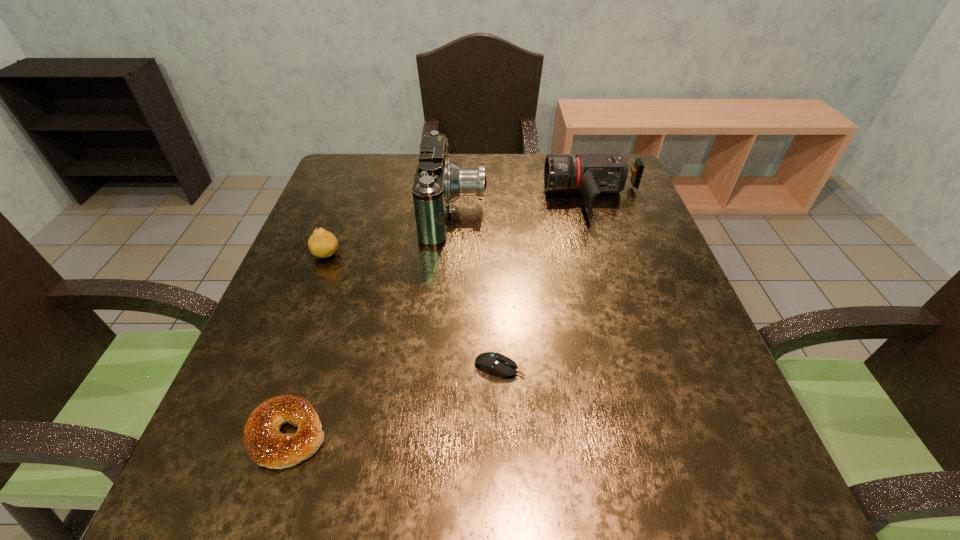
Locate an element on the screen. blank area in the image that satisfies the following two spatial constraints: 1. on the front-facing side of the tallest object; 2. on the front side of the fourth tallest object is located at coordinates (439, 434).

You are a GUI agent. You are given a task and a screenshot of the screen. Output one action in this format:
    pyautogui.click(x=<x>, y=<y>)
    Task: Click on the free spot that satisfies the following two spatial constraints: 1. on the front side of the computer mouse; 2. on the right side of the pear
    This screenshot has height=540, width=960.
    Given the screenshot: What is the action you would take?
    pyautogui.click(x=283, y=367)

You are a GUI agent. You are given a task and a screenshot of the screen. Output one action in this format:
    pyautogui.click(x=<x>, y=<y>)
    Task: Click on the vacant region that satisfies the following two spatial constraints: 1. on the front side of the pear; 2. on the left side of the shortest object
    The height and width of the screenshot is (540, 960).
    Given the screenshot: What is the action you would take?
    [x=283, y=367]